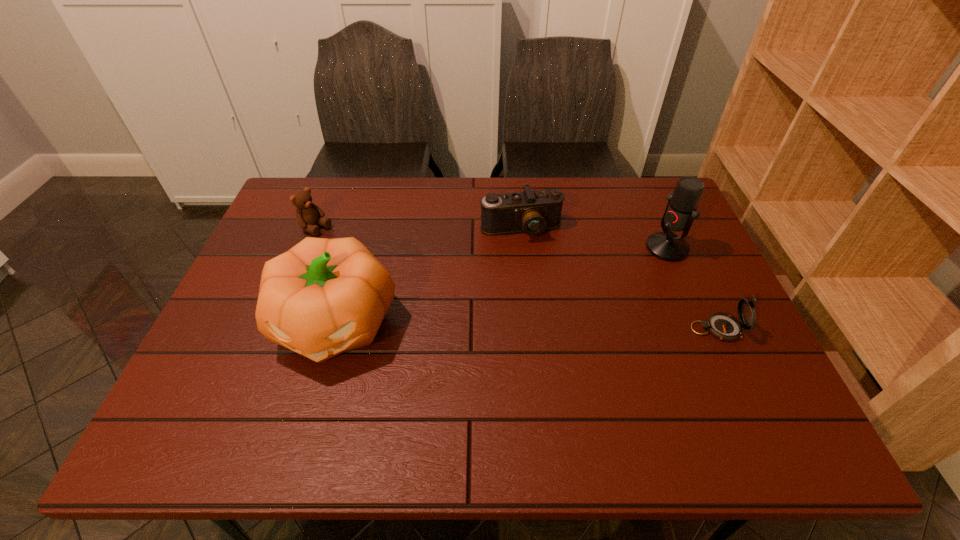
Where is `microphone that is at the right edge`? This screenshot has height=540, width=960. microphone that is at the right edge is located at coordinates (680, 212).

You are a GUI agent. You are given a task and a screenshot of the screen. Output one action in this format:
    pyautogui.click(x=<x>, y=<y>)
    Task: Click on the object present at the far left corner
    The width and height of the screenshot is (960, 540).
    Given the screenshot: What is the action you would take?
    pyautogui.click(x=308, y=214)

I want to click on object located in the near left corner section of the desktop, so click(323, 297).

In the image, there is a desktop. In order to click on vacant space at the far edge in this screenshot , I will do `click(507, 181)`.

Where is `vacant space at the near edge`? vacant space at the near edge is located at coordinates (324, 380).

Find the location of a particular element. The image size is (960, 540). vacant space at the right edge of the desktop is located at coordinates (694, 289).

In the image, there is a desktop. Where is `free region at the far left corner`? The image size is (960, 540). free region at the far left corner is located at coordinates (328, 184).

At what (x,y) coordinates should I click in order to perform the action: click on free spot between the compass and the teddy bear. Please return your answer as a coordinate pair (x, y). The width and height of the screenshot is (960, 540). Looking at the image, I should click on (516, 279).

The width and height of the screenshot is (960, 540). Find the location of `free spot between the teddy bear and the camera`. free spot between the teddy bear and the camera is located at coordinates (419, 229).

Where is `empty space that is in between the camera and the compass`? Image resolution: width=960 pixels, height=540 pixels. empty space that is in between the camera and the compass is located at coordinates (618, 279).